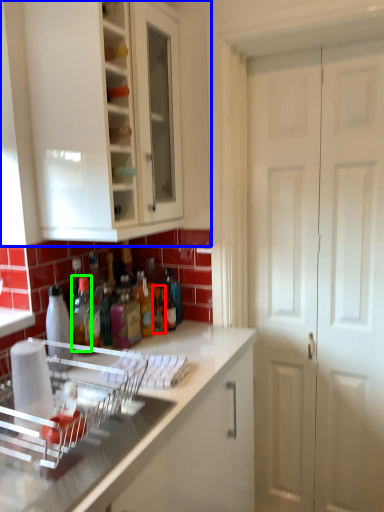
Question: Which object is the farthest from bottle (highlighted by a red box)? Choose among these: cabinetry (highlighted by a blue box) or bottle (highlighted by a green box).

Choices:
 (A) cabinetry
 (B) bottle

Answer: (A)